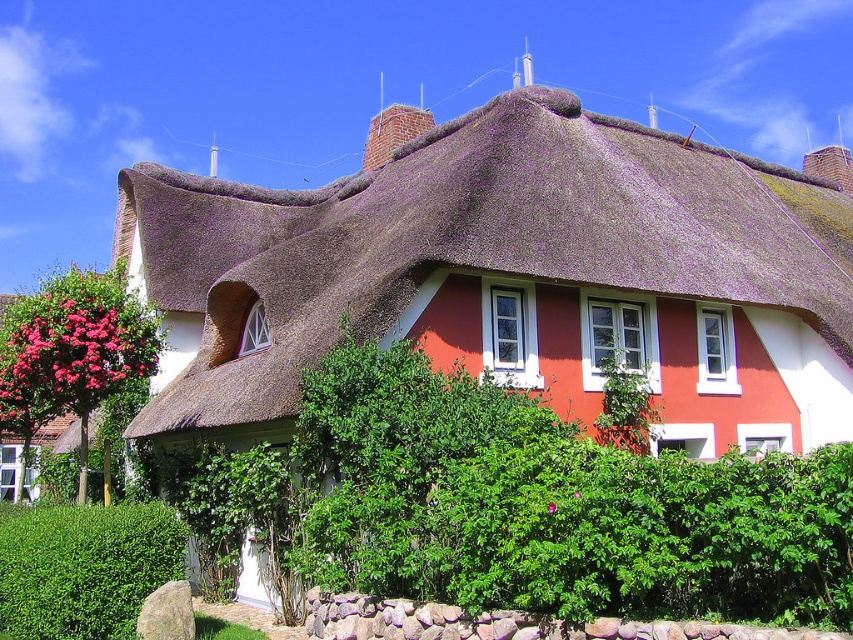
You are standing in front of the traditional house with a thatched roof. You notice two points marked on the house. The first point is located at coordinates point (848, 301), and the second point is at point (45, 532). From your perspective, which point is closer to you?

Point (45, 532) is closer to you because it is in front of point (848, 301), which is behind it.

You are a drone operator trying to capture a photo of the pink matte flower at center from above the thatched brown roof at upper center. Given the height of the roof and the distance between them, can you estimate whether the drone can hover directly above the flower while staying above the roof?

The thatched brown roof at upper center is 124.27 feet from the pink matte flower at center. Since the drone needs to hover above both the roof and the flower, the distance between them allows the drone to position itself directly above the flower while maintaining altitude above the roof.